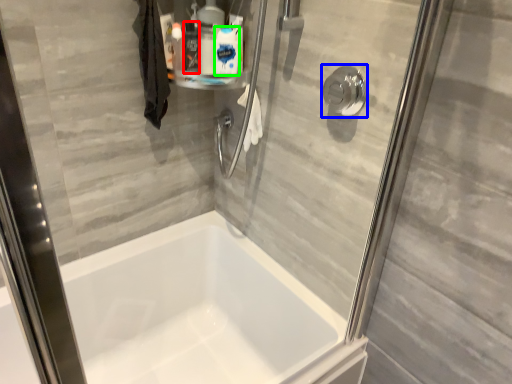
Question: Which is nearer to the cleaning product (highlighted by a red box)? shower (highlighted by a blue box) or cleaning product (highlighted by a green box).

Choices:
 (A) shower
 (B) cleaning product

Answer: (B)